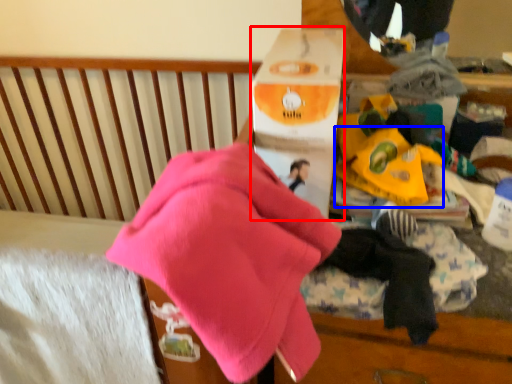
Question: Which object appears farthest to the camera in this image, cardboard box (highlighted by a red box) or toy (highlighted by a blue box)?

Choices:
 (A) cardboard box
 (B) toy

Answer: (B)